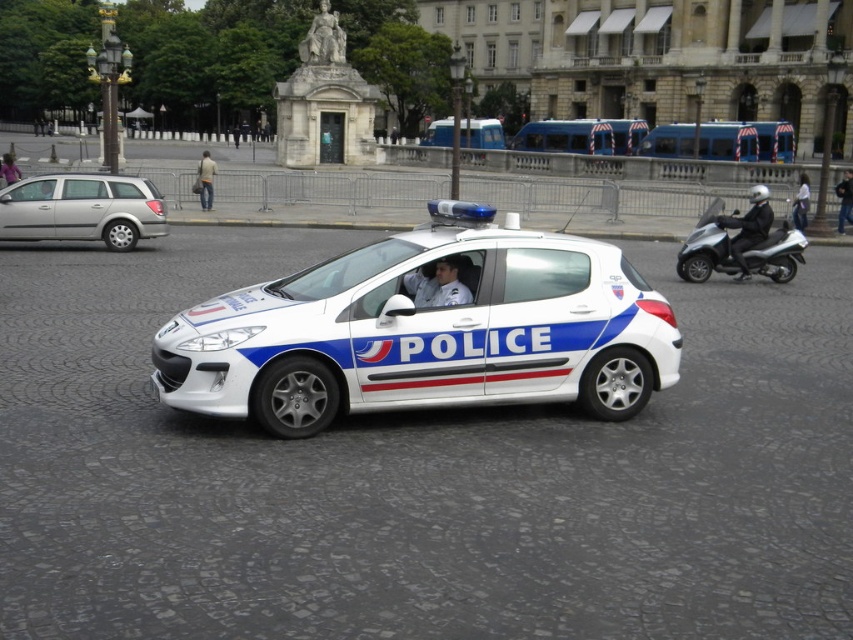
You are standing at the point marked as point (x=722, y=141) in the image. You want to reach the blue metallic bus at center. Which direction should you move in?

The point (x=722, y=141) indicates the blue metallic bus at center, so you are already at the location of the blue metallic bus at center.

You are a delivery person who needs to load a package onto a truck. The truck has a height limit of 2 meters. You see the blue metallic bus at center and the white glossy motorcycle at right in the image. Which object can safely pass under the truck without hitting the height limit?

The white glossy motorcycle at right can safely pass under the truck since it is shorter than the blue metallic bus at center, which exceeds the 2 meter height limit.

You are a pedestrian standing at the right side of the plaza. You want to cross to the left side to reach the entrance of the building. There is a silver metallic station wagon at left and a blue metallic bus at center. Which vehicle should you avoid to safely cross the plaza?

You should avoid the blue metallic bus at center because the silver metallic station wagon at left is to the left of it, meaning the bus is closer to your path on the right side. However, since you are on the right and want to go left, both vehicles are in your path. Wait for them to move first.